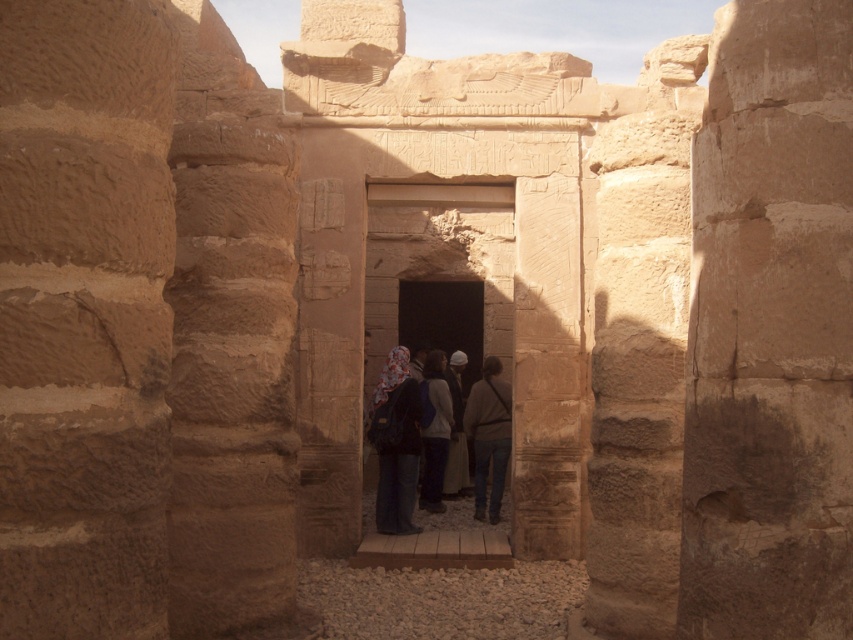
Question: Which object is positioned closest to the brown stone doorway at center?

Choices:
 (A) white fabric headscarf at center
 (B) brown leather jacket at center
 (C) floral-patterned scarf at center

Answer: (A)

Question: Can you confirm if floral-patterned scarf at center is thinner than brown leather jacket at center?

Choices:
 (A) yes
 (B) no

Answer: (B)

Question: Considering the relative positions of floral-patterned scarf at center and brown leather jacket at center in the image provided, where is floral-patterned scarf at center located with respect to brown leather jacket at center?

Choices:
 (A) below
 (B) above

Answer: (B)

Question: Among these points, which one is farthest from the camera?

Choices:
 (A) (419, 497)
 (B) (503, 195)
 (C) (483, 374)

Answer: (A)

Question: Is floral-patterned scarf at center positioned before dark brown leather jacket at center?

Choices:
 (A) yes
 (B) no

Answer: (A)

Question: Which point appears closest to the camera in this image?

Choices:
 (A) (421, 484)
 (B) (393, 182)
 (C) (479, 458)

Answer: (B)